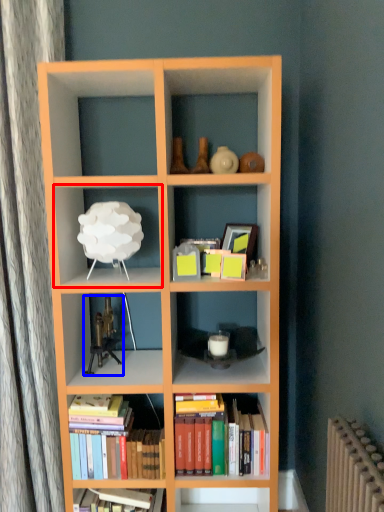
Question: Which object is further to the camera taking this photo, shelf (highlighted by a red box) or toy (highlighted by a blue box)?

Choices:
 (A) shelf
 (B) toy

Answer: (B)